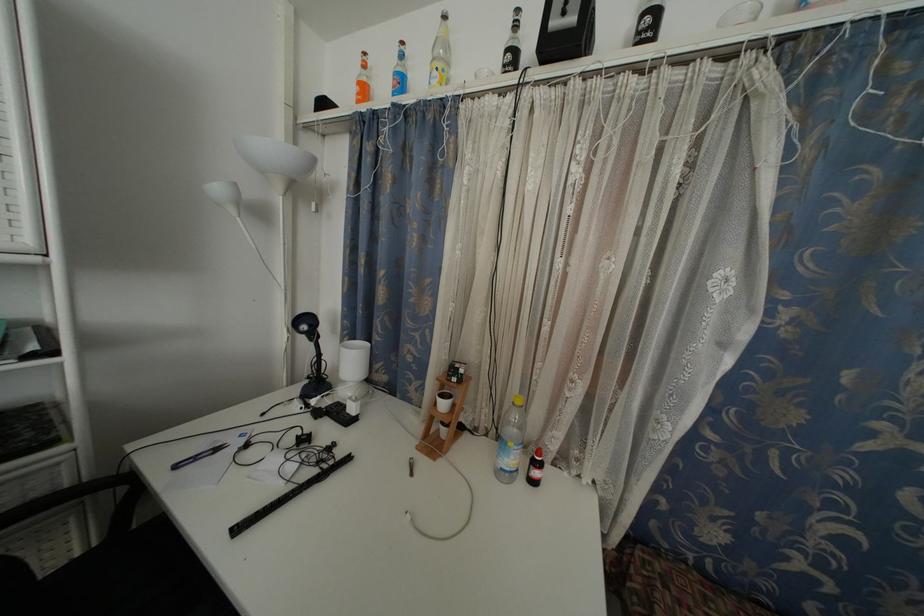
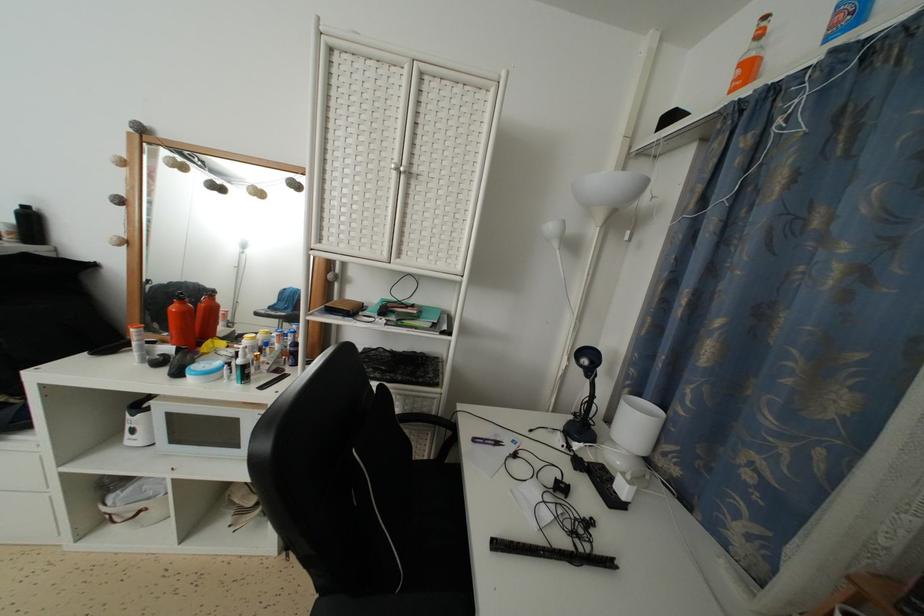
Where in the second image is the point corresponding to point 362,89 from the first image?

(746, 70)